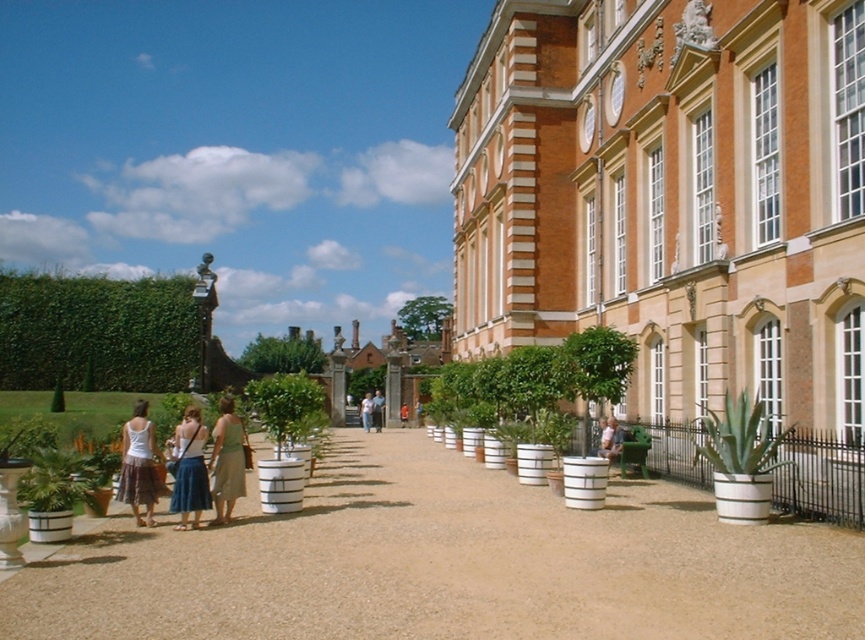
Question: From the image, what is the correct spatial relationship of light blue denim skirt at center in relation to light brown leather jacket at center?

Choices:
 (A) left
 (B) right

Answer: (B)

Question: Which point is closer to the camera?

Choices:
 (A) (377, 416)
 (B) (142, 410)

Answer: (B)

Question: Does denim skirt at lower left appear on the left side of orange fabric shirt at center?

Choices:
 (A) yes
 (B) no

Answer: (A)

Question: Does green leafy hedge at left have a lesser width compared to green fabric dress at center?

Choices:
 (A) no
 (B) yes

Answer: (A)

Question: Which point appears farthest from the camera in this image?

Choices:
 (A) (112, 356)
 (B) (186, 518)
 (C) (295, 390)

Answer: (A)

Question: Which object is farther from the camera taking this photo?

Choices:
 (A) light blue denim skirt at center
 (B) white textured planter at center
 (C) green matte plant at center

Answer: (A)